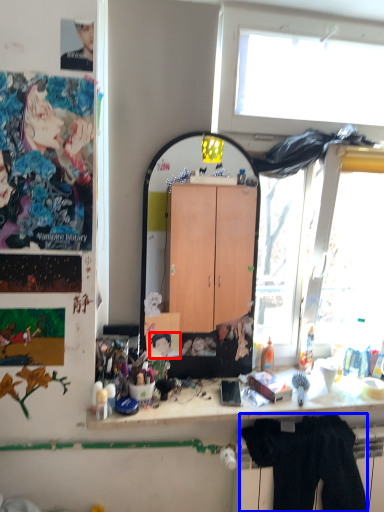
Question: Which object is further to the camera taking this photo, person (highlighted by a red box) or clothing (highlighted by a blue box)?

Choices:
 (A) person
 (B) clothing

Answer: (A)